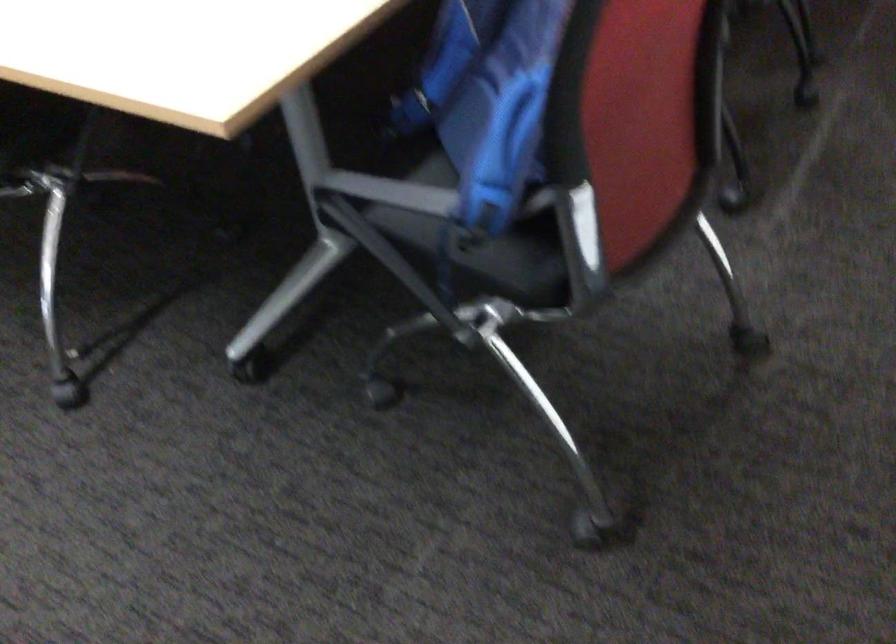
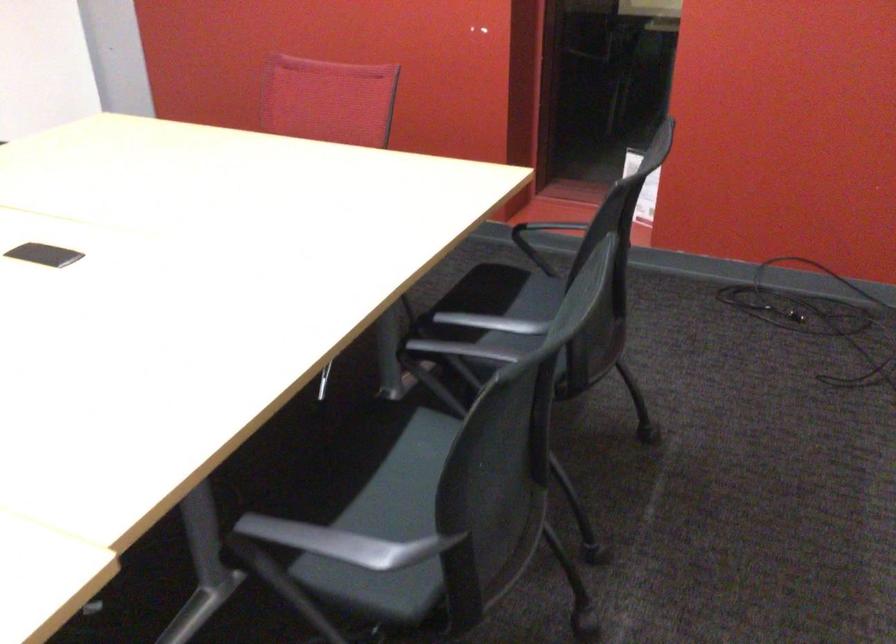
Question: How did the camera likely rotate?

Choices:
 (A) Left
 (B) Right
 (C) Up
 (D) Down

Answer: (C)